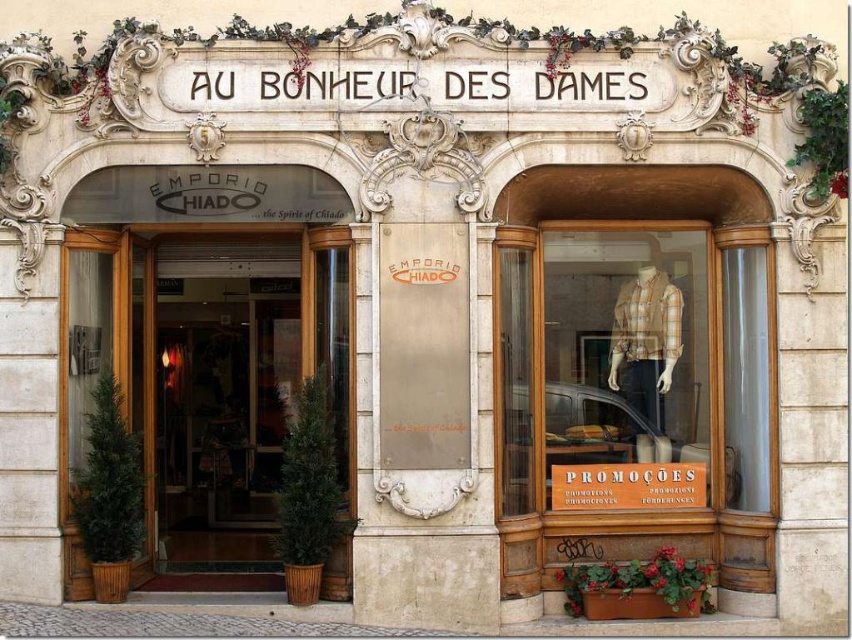
Question: Can you confirm if wooden mannequin at center is positioned above green glossy door at center?

Choices:
 (A) yes
 (B) no

Answer: (A)

Question: Does wooden mannequin at center appear on the left side of green glossy door at center?

Choices:
 (A) yes
 (B) no

Answer: (B)

Question: Can you confirm if wooden mannequin at center is positioned above green glossy door at center?

Choices:
 (A) no
 (B) yes

Answer: (B)

Question: Which object is closer to the camera taking this photo?

Choices:
 (A) wooden mannequin at center
 (B) green glossy door at center

Answer: (B)